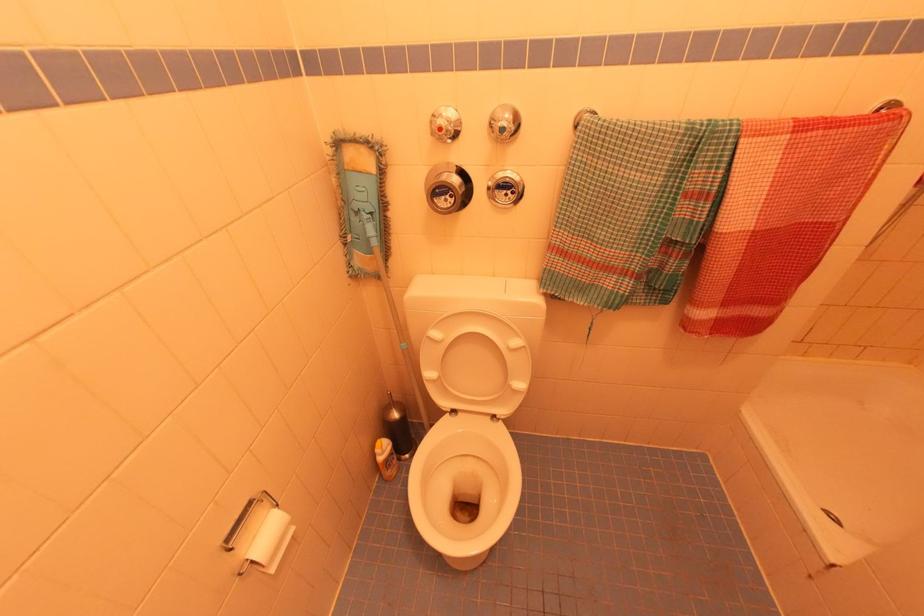
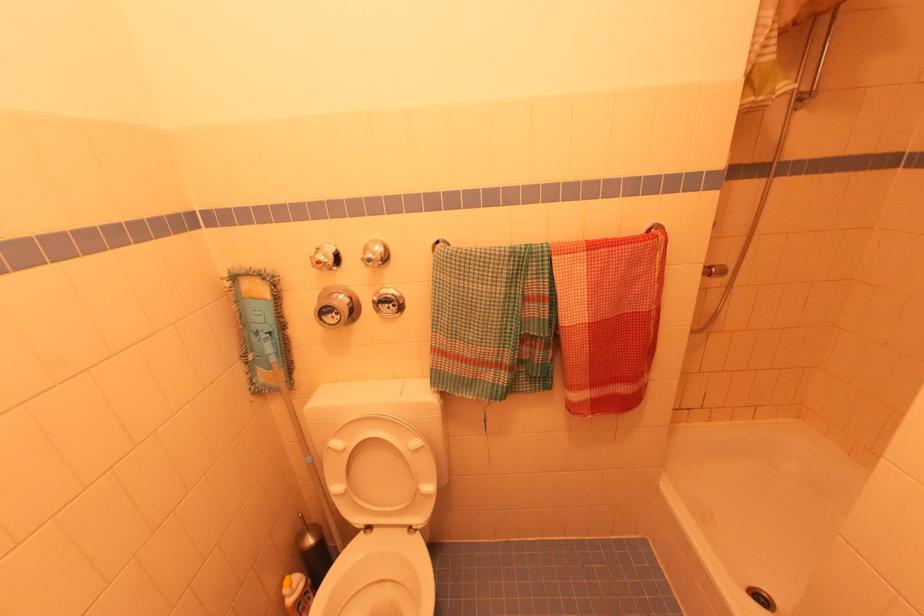
Locate, in the second image, the point that corresponds to [444,198] in the first image.

(332, 315)